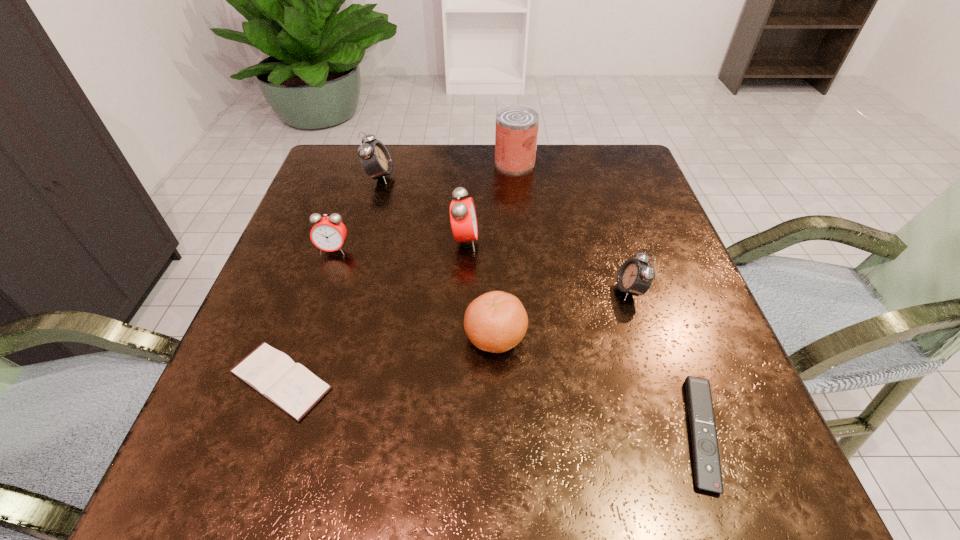
Locate an element on the screen. The width and height of the screenshot is (960, 540). vacant area in the image that satisfies the following two spatial constraints: 1. on the front-facing side of the remote control; 2. on the left side of the right red alarm clock is located at coordinates (458, 433).

Find the location of a particular element. The width and height of the screenshot is (960, 540). free region that satisfies the following two spatial constraints: 1. on the front-facing side of the clementine; 2. on the right side of the smaller red alarm clock is located at coordinates tap(304, 337).

Identify the location of vacant region that satisfies the following two spatial constraints: 1. on the back side of the can; 2. on the left side of the brown diary. (358, 163).

Locate an element on the screen. Image resolution: width=960 pixels, height=540 pixels. vacant space that satisfies the following two spatial constraints: 1. on the front-facing side of the second alarm clock from right to left; 2. on the back side of the remote control is located at coordinates 458,433.

Identify the location of blank area in the image that satisfies the following two spatial constraints: 1. on the face of the nearer white alarm clock; 2. on the right side of the remote control. (676, 433).

You are a GUI agent. You are given a task and a screenshot of the screen. Output one action in this format:
    pyautogui.click(x=<x>, y=<y>)
    Task: Click on the free region that satisfies the following two spatial constraints: 1. on the face of the remote control; 2. on the left side of the nearest alarm clock
    
    Given the screenshot: What is the action you would take?
    pyautogui.click(x=676, y=433)